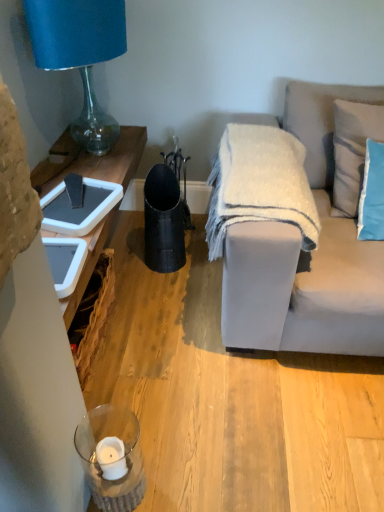
What do you see at coordinates (320, 122) in the screenshot? The width and height of the screenshot is (384, 512). I see `light gray fabric pillow at upper right, which is counted as the 2th pillow, starting from the bottom` at bounding box center [320, 122].

You are a GUI agent. You are given a task and a screenshot of the screen. Output one action in this format:
    pyautogui.click(x=<x>, y=<y>)
    Task: Click on the blue glass lamp at upper left
    
    Given the screenshot: What is the action you would take?
    pyautogui.click(x=80, y=54)

Is blue fabric pillow at upper right, the 1th pillow positioned from the bottom, touching light gray fabric couch at right?

No, blue fabric pillow at upper right, the 1th pillow positioned from the bottom, is not next to light gray fabric couch at right.

Does blue fabric pillow at upper right, the 1th pillow positioned from the bottom, have a greater width compared to light gray fabric couch at right?

Incorrect, the width of blue fabric pillow at upper right, the 1th pillow positioned from the bottom, does not surpass that of light gray fabric couch at right.

Could you tell me if blue fabric pillow at upper right, marked as the second pillow in a top-to-bottom arrangement, is facing light gray fabric couch at right?

Yes, blue fabric pillow at upper right, marked as the second pillow in a top-to-bottom arrangement, is facing light gray fabric couch at right.

Where is `blanket below the blue fabric pillow at upper right, the 1th pillow positioned from the bottom (from a real-world perspective)`? The width and height of the screenshot is (384, 512). blanket below the blue fabric pillow at upper right, the 1th pillow positioned from the bottom (from a real-world perspective) is located at coordinates (260, 184).

Is white fuzzy blanket at center completely or partially inside blue fabric pillow at upper right, the 1th pillow positioned from the bottom?

No, white fuzzy blanket at center is not inside blue fabric pillow at upper right, the 1th pillow positioned from the bottom.

How many degrees apart are the facing directions of blue fabric pillow at upper right, marked as the second pillow in a top-to-bottom arrangement, and white fuzzy blanket at center?

They differ by 6.26 degrees in their facing directions.

Considering the points (355, 145) and (263, 131), which point is behind, point (355, 145) or point (263, 131)?

The point (263, 131) is farther from the camera.

Is light gray fabric pillow at upper right, marked as the 1th pillow in a top-to-bottom arrangement, placed right next to light gray fabric couch at right?

No.

Is light gray fabric pillow at upper right, which is counted as the 2th pillow, starting from the bottom, positioned before light gray fabric couch at right?

That is False.

Could you tell me if light gray fabric pillow at upper right, which is counted as the 2th pillow, starting from the bottom, is turned towards light gray fabric couch at right?

Yes, light gray fabric pillow at upper right, which is counted as the 2th pillow, starting from the bottom, is aimed at light gray fabric couch at right.

Considering the relative sizes of light gray fabric pillow at upper right, marked as the 1th pillow in a top-to-bottom arrangement, and light gray fabric couch at right in the image provided, is light gray fabric pillow at upper right, marked as the 1th pillow in a top-to-bottom arrangement, taller than light gray fabric couch at right?

In fact, light gray fabric pillow at upper right, marked as the 1th pillow in a top-to-bottom arrangement, may be shorter than light gray fabric couch at right.

From a real-world perspective, who is located higher, light gray fabric pillow at upper right, marked as the 1th pillow in a top-to-bottom arrangement, or white fuzzy blanket at center?

In real-world perspective, light gray fabric pillow at upper right, marked as the 1th pillow in a top-to-bottom arrangement, is above.

Considering the positions of objects light gray fabric pillow at upper right, marked as the 1th pillow in a top-to-bottom arrangement, and white fuzzy blanket at center in the image provided, who is more to the left, light gray fabric pillow at upper right, marked as the 1th pillow in a top-to-bottom arrangement, or white fuzzy blanket at center?

white fuzzy blanket at center is more to the left.

Is light gray fabric pillow at upper right, marked as the 1th pillow in a top-to-bottom arrangement, spatially inside white fuzzy blanket at center, or outside of it?

The correct answer is: outside.

Are light gray fabric pillow at upper right, marked as the 1th pillow in a top-to-bottom arrangement, and white fuzzy blanket at center far apart?

Actually, light gray fabric pillow at upper right, marked as the 1th pillow in a top-to-bottom arrangement, and white fuzzy blanket at center are a little close together.

Would you say white fuzzy blanket at center is a long distance from blue fabric pillow at upper right, the 1th pillow positioned from the bottom?

No, there isn't a large distance between white fuzzy blanket at center and blue fabric pillow at upper right, the 1th pillow positioned from the bottom.

Could blue fabric pillow at upper right, marked as the second pillow in a top-to-bottom arrangement, be considered to be inside white fuzzy blanket at center?

No.

Which object is closer to the camera taking this photo, white fuzzy blanket at center or blue fabric pillow at upper right, marked as the second pillow in a top-to-bottom arrangement?

white fuzzy blanket at center is in front.

Is white fuzzy blanket at center taller or shorter than blue fabric pillow at upper right, the 1th pillow positioned from the bottom?

Clearly, white fuzzy blanket at center is shorter compared to blue fabric pillow at upper right, the 1th pillow positioned from the bottom.

Looking at this image, which of these two, blue glass lamp at upper left or white fuzzy blanket at center, is thinner?

With smaller width is blue glass lamp at upper left.

What's the angular difference between blue glass lamp at upper left and white fuzzy blanket at center's facing directions?

blue glass lamp at upper left and white fuzzy blanket at center are facing 96.7 degrees away from each other.

Which is more to the left, blue glass lamp at upper left or white fuzzy blanket at center?

blue glass lamp at upper left is more to the left.

You are a GUI agent. You are given a task and a screenshot of the screen. Output one action in this format:
    pyautogui.click(x=<x>, y=<y>)
    Task: Click on the lamp above the white fuzzy blanket at center (from the image's perspective)
    The image size is (384, 512).
    Given the screenshot: What is the action you would take?
    pyautogui.click(x=80, y=54)

In the scene shown: Is light gray fabric couch at right looking in the opposite direction of blue glass lamp at upper left?

light gray fabric couch at right does not have its back to blue glass lamp at upper left.

Can you confirm if light gray fabric couch at right is smaller than blue glass lamp at upper left?

No.

Can you confirm if light gray fabric couch at right is taller than blue glass lamp at upper left?

Yes.

Which pillow is the 1st one when counting from the back of the light gray fabric couch at right? Please provide its 2D coordinates.

[(352, 151)]

This screenshot has width=384, height=512. Identify the location of the 2nd pillow counting from the right of the white fuzzy blanket at center. (352, 151).

Estimate the real-world distances between objects in this image. Which object is further from light gray fabric couch at right, blue fabric pillow at upper right, marked as the second pillow in a top-to-bottom arrangement, or light gray fabric pillow at upper right, which is counted as the 2th pillow, starting from the bottom?

blue fabric pillow at upper right, marked as the second pillow in a top-to-bottom arrangement, lies further to light gray fabric couch at right than the other object.

Based on their spatial positions, is blue glass lamp at upper left or light gray fabric couch at right closer to light gray fabric pillow at upper right, which is counted as the 2th pillow, starting from the bottom?

light gray fabric couch at right.

Based on the photo, looking at the image, which one is located further to blue fabric pillow at upper right, marked as the second pillow in a top-to-bottom arrangement, blue glass lamp at upper left or light gray fabric pillow at upper right, which is counted as the 2th pillow, starting from the bottom?

Based on the image, blue glass lamp at upper left appears to be further to blue fabric pillow at upper right, marked as the second pillow in a top-to-bottom arrangement.

Considering their positions, is light gray fabric couch at right positioned closer to white fuzzy blanket at center than light gray fabric pillow at upper right, which is counted as the 2th pillow, starting from the bottom?

Based on the image, light gray fabric couch at right appears to be nearer to white fuzzy blanket at center.

Consider the image. Considering their positions, is light gray fabric pillow at upper right, marked as the 1th pillow in a top-to-bottom arrangement, positioned further to blue glass lamp at upper left than white fuzzy blanket at center?

The object further to blue glass lamp at upper left is light gray fabric pillow at upper right, marked as the 1th pillow in a top-to-bottom arrangement.

Looking at the image, which one is located further to light gray fabric couch at right, light gray fabric pillow at upper right, marked as the 1th pillow in a top-to-bottom arrangement, or white fuzzy blanket at center?

light gray fabric pillow at upper right, marked as the 1th pillow in a top-to-bottom arrangement, is positioned further to the anchor light gray fabric couch at right.

Based on their spatial positions, is light gray fabric pillow at upper right, marked as the 1th pillow in a top-to-bottom arrangement, or light gray fabric couch at right closer to blue fabric pillow at upper right, marked as the second pillow in a top-to-bottom arrangement?

light gray fabric pillow at upper right, marked as the 1th pillow in a top-to-bottom arrangement, is closer to blue fabric pillow at upper right, marked as the second pillow in a top-to-bottom arrangement.

Consider the image. Estimate the real-world distances between objects in this image. Which object is closer to blue fabric pillow at upper right, marked as the second pillow in a top-to-bottom arrangement, white fuzzy blanket at center or blue glass lamp at upper left?

white fuzzy blanket at center is closer to blue fabric pillow at upper right, marked as the second pillow in a top-to-bottom arrangement.

Locate an element on the screen. Image resolution: width=384 pixels, height=512 pixels. pillow located between white fuzzy blanket at center and blue fabric pillow at upper right, the 1th pillow positioned from the bottom, in the left-right direction is located at coordinates (320, 122).

I want to click on studio couch located between white fuzzy blanket at center and blue fabric pillow at upper right, marked as the second pillow in a top-to-bottom arrangement, in the left-right direction, so click(307, 255).

At what (x,y) coordinates should I click in order to perform the action: click on studio couch located between blue glass lamp at upper left and light gray fabric pillow at upper right, marked as the 1th pillow in a top-to-bottom arrangement, in the left-right direction. Please return your answer as a coordinate pair (x, y). The height and width of the screenshot is (512, 384). Looking at the image, I should click on (307, 255).

This screenshot has width=384, height=512. In order to click on blanket between blue glass lamp at upper left and light gray fabric couch at right in this screenshot , I will do `click(260, 184)`.